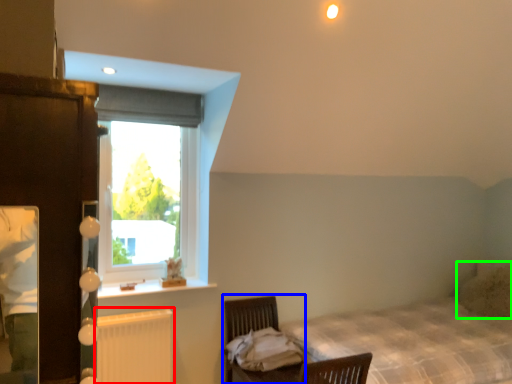
Question: Which is nearer to the radiator (highlighted by a red box)? swivel chair (highlighted by a blue box) or pillow (highlighted by a green box).

Choices:
 (A) swivel chair
 (B) pillow

Answer: (A)